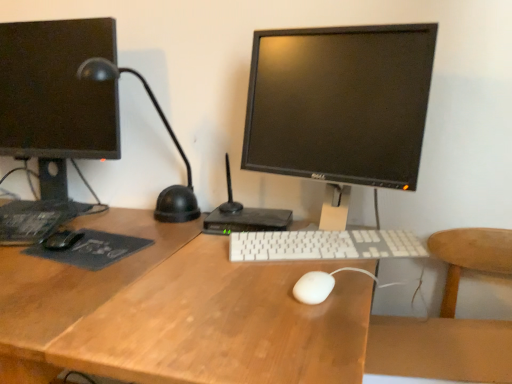
The width and height of the screenshot is (512, 384). Find the location of `free space in front of white plastic keyboard at center`. free space in front of white plastic keyboard at center is located at coordinates (296, 301).